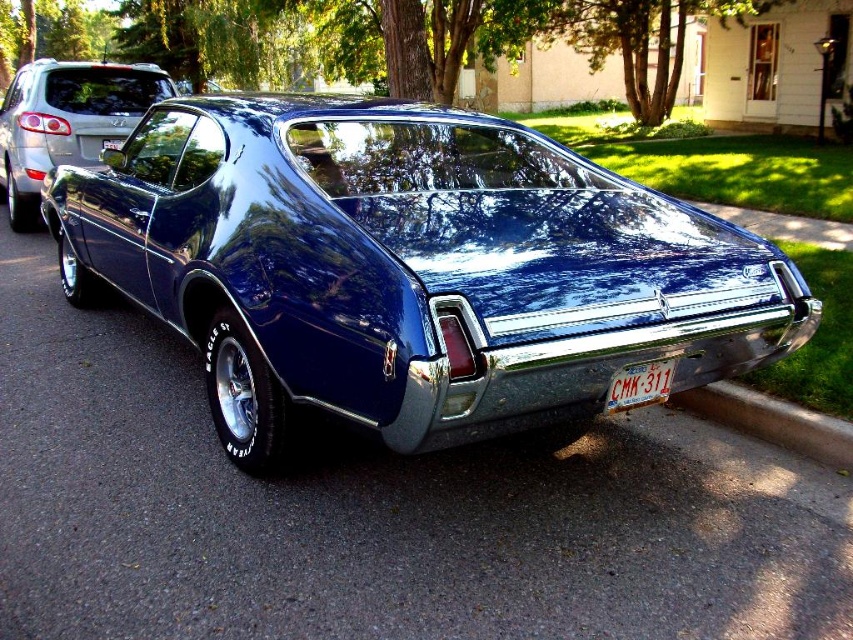
Which is more to the left, glossy blue car at center or glossy blue car at left?

glossy blue car at left is more to the left.

Between point (138, 296) and point (32, 221), which one is positioned behind?

The point (32, 221) is behind.

Find the location of `glossy blue car at center`. glossy blue car at center is located at coordinates (409, 268).

Image resolution: width=853 pixels, height=640 pixels. I want to click on glossy blue car at center, so click(409, 268).

From the picture: Can you confirm if glossy blue car at center is bigger than white plastic license plate at lower center?

Indeed, glossy blue car at center has a larger size compared to white plastic license plate at lower center.

Where is `glossy blue car at center`? The image size is (853, 640). glossy blue car at center is located at coordinates (409, 268).

Identify the location of glossy blue car at center. The image size is (853, 640). (409, 268).

Does glossy blue car at left appear under gray concrete curb at lower right?

No, glossy blue car at left is not below gray concrete curb at lower right.

Can you confirm if glossy blue car at left is wider than gray concrete curb at lower right?

No.

Which is in front, point (38, 188) or point (761, 429)?

Point (761, 429) is more forward.

This screenshot has height=640, width=853. What are the coordinates of `glossy blue car at left` in the screenshot? It's located at (67, 122).